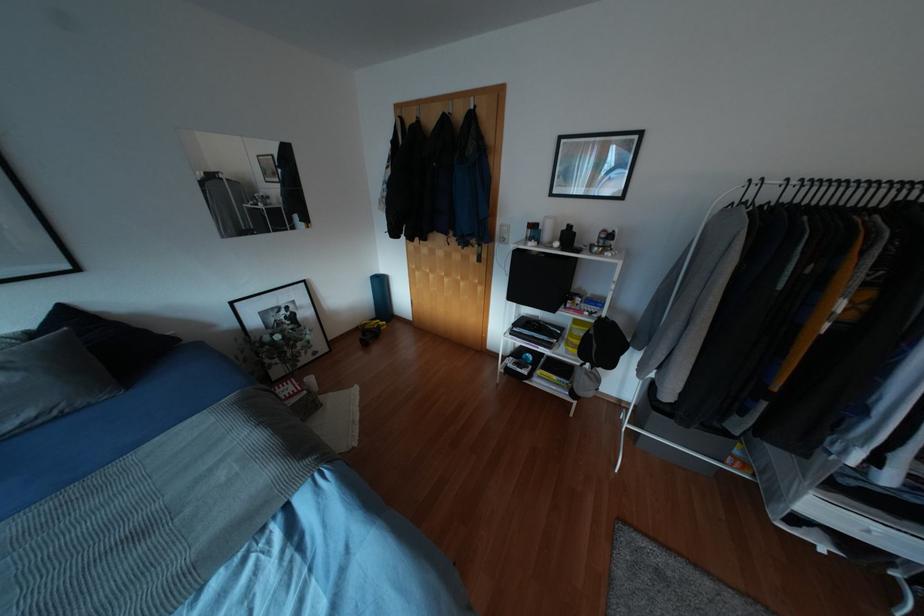
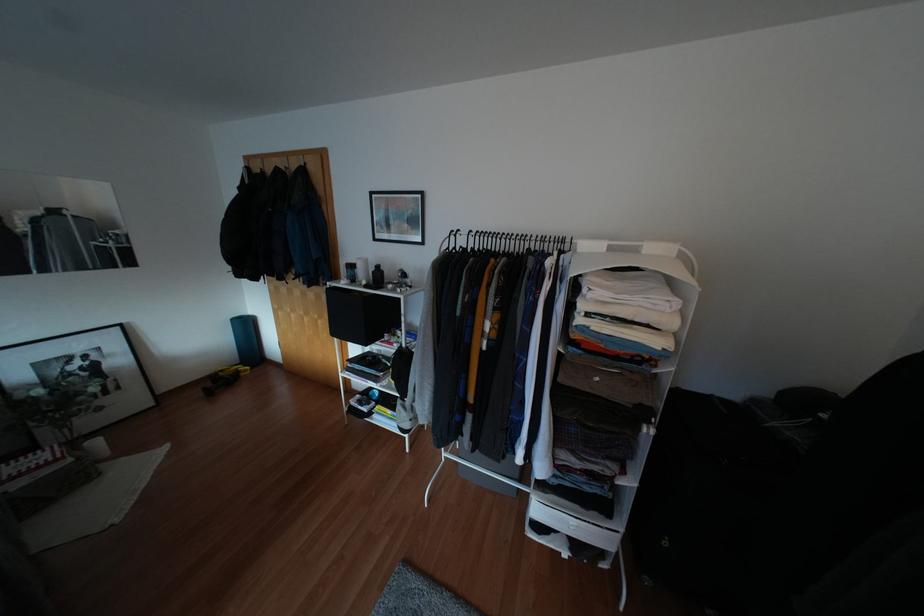
Question: I am providing you with two images of the same scene from different viewpoints. Which of the following objects are not visible in image2?

Choices:
 (A) white plant pot
 (B) white fabric handle
 (C) white spray bottle
 (D) none of these

Answer: (D)